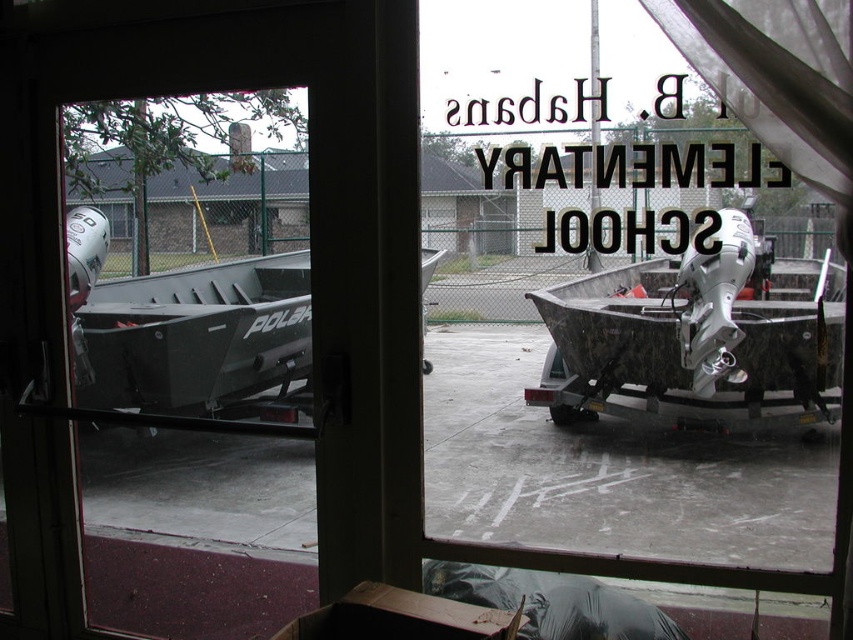
Who is lower down, transparent glass door at center or rusty metal boat at right?

Positioned lower is transparent glass door at center.

Is transparent glass door at center bigger than rusty metal boat at right?

No.

Locate an element on the screen. The image size is (853, 640). transparent glass door at center is located at coordinates (656, 333).

Find the location of a particular element. transparent glass door at center is located at coordinates (656, 333).

Looking at this image, is transparent glass door at center shorter than matte gray boat at left?

Indeed, transparent glass door at center has a lesser height compared to matte gray boat at left.

Is transparent glass door at center below matte gray boat at left?

Correct, transparent glass door at center is located below matte gray boat at left.

At what (x,y) coordinates should I click in order to perform the action: click on transparent glass door at center. Please return your answer as a coordinate pair (x, y). Looking at the image, I should click on tap(656, 333).

Is rusty metal boat at right thinner than matte gray boat at left?

Incorrect, rusty metal boat at right's width is not less than matte gray boat at left's.

Image resolution: width=853 pixels, height=640 pixels. Identify the location of rusty metal boat at right. (697, 339).

The width and height of the screenshot is (853, 640). I want to click on rusty metal boat at right, so click(x=697, y=339).